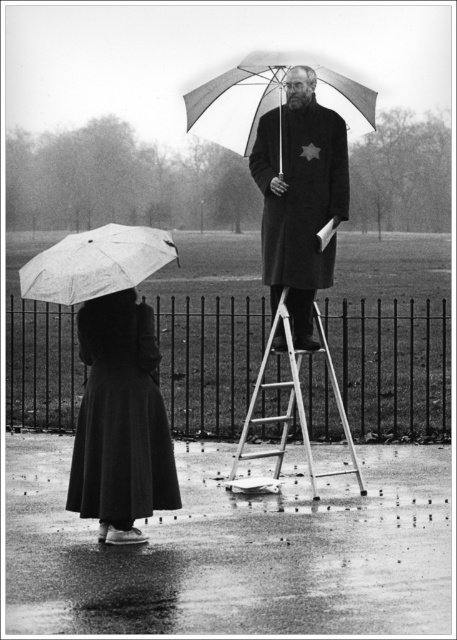
Question: Is white matte umbrella at upper center positioned behind metallic silver ladder at center?

Choices:
 (A) yes
 (B) no

Answer: (A)

Question: From the image, what is the correct spatial relationship of matte black coat at lower left in relation to metallic silver ladder at center?

Choices:
 (A) right
 (B) left

Answer: (B)

Question: Which point is farther to the camera?

Choices:
 (A) transparent plastic umbrella at lower left
 (B) white matte umbrella at upper center
 (C) metallic wire fence at center
 (D) metallic silver ladder at center

Answer: (C)

Question: Among these points, which one is nearest to the camera?

Choices:
 (A) (117, 344)
 (B) (327, 198)

Answer: (A)

Question: Which point is farther to the camera?

Choices:
 (A) (309, 454)
 (B) (67, 301)
 (C) (37, 406)
 (D) (100, 481)

Answer: (C)

Question: Is matte black coat at lower left above matte black coat at center?

Choices:
 (A) yes
 (B) no

Answer: (B)